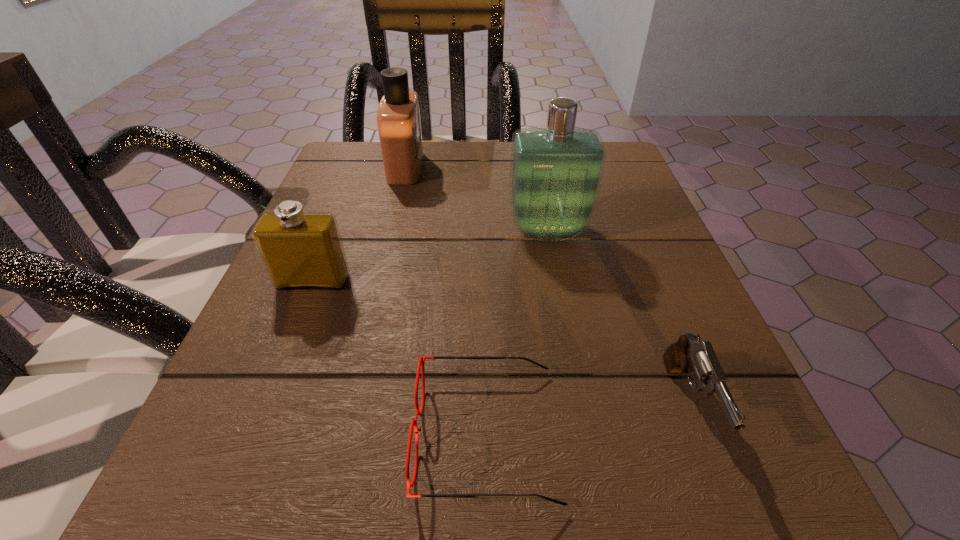
Identify which perfume is located as the second nearest to the second tallest perfume. Please provide its 2D coordinates. Your answer should be formatted as a tuple, i.e. [(x, y)], where the tuple contains the x and y coordinates of a point satisfying the conditions above.

[(300, 250)]

Choose which perfume is the second nearest neighbor to the second perfume from right to left. Please provide its 2D coordinates. Your answer should be formatted as a tuple, i.e. [(x, y)], where the tuple contains the x and y coordinates of a point satisfying the conditions above.

[(300, 250)]

What are the coordinates of `vacant position in the image that satisfies the following two spatial constraints: 1. on the front label of the second perfume from right to left; 2. on the front-facing side of the third tallest object` in the screenshot? It's located at (378, 281).

At what (x,y) coordinates should I click in order to perform the action: click on vacant space that satisfies the following two spatial constraints: 1. on the front label of the rightmost perfume; 2. on the front-facing side of the spectacles. Please return your answer as a coordinate pair (x, y). Looking at the image, I should click on (585, 434).